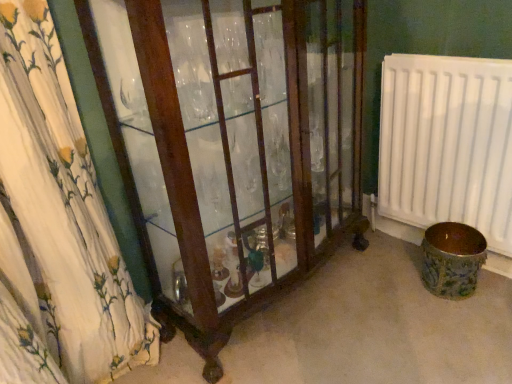
The height and width of the screenshot is (384, 512). Find the location of `brown ceramic vase at lower right`. brown ceramic vase at lower right is located at coordinates (452, 259).

I want to click on white plastic radiator at right, so click(447, 144).

Is brown ceramic vase at lower right inside white plastic radiator at right?

No, brown ceramic vase at lower right is located outside of white plastic radiator at right.

How many degrees apart are the facing directions of white plastic radiator at right and brown ceramic vase at lower right?

The angle between the facing direction of white plastic radiator at right and the facing direction of brown ceramic vase at lower right is 0.431 degrees.

Which of these two, white plastic radiator at right or brown ceramic vase at lower right, is wider?

Wider between the two is brown ceramic vase at lower right.

Does point (433, 214) lie in front of point (251, 20)?

No.

Identify the location of radiator directly beneath the mahogany glass cabinet at left (from a real-world perspective). Image resolution: width=512 pixels, height=384 pixels. (447, 144).

Between white plastic radiator at right and mahogany glass cabinet at left, which one appears on the right side from the viewer's perspective?

From the viewer's perspective, white plastic radiator at right appears more on the right side.

Which of these two, white plastic radiator at right or mahogany glass cabinet at left, is wider?

mahogany glass cabinet at left.

Based on the photo, from the image's perspective, relative to white plastic radiator at right, is mahogany glass cabinet at left above or below?

From the image's perspective, mahogany glass cabinet at left appears below white plastic radiator at right.

Which is in front, point (162, 250) or point (393, 180)?

The point (162, 250) is closer to the camera.

From a real-world perspective, is mahogany glass cabinet at left physically below white plastic radiator at right?

Incorrect, from a real-world perspective, mahogany glass cabinet at left is higher than white plastic radiator at right.

Is mahogany glass cabinet at left oriented away from white plastic radiator at right?

No, mahogany glass cabinet at left's orientation is not away from white plastic radiator at right.

Is brown ceramic vase at lower right next to white plastic radiator at right and touching it?

They are not placed beside each other.

Considering the sizes of brown ceramic vase at lower right and white plastic radiator at right in the image, is brown ceramic vase at lower right wider or thinner than white plastic radiator at right?

Clearly, brown ceramic vase at lower right has more width compared to white plastic radiator at right.

This screenshot has height=384, width=512. Identify the location of toilet bowl lying behind the white plastic radiator at right. (452, 259).

What's the angular difference between mahogany glass cabinet at left and brown ceramic vase at lower right's facing directions?

The angular difference between mahogany glass cabinet at left and brown ceramic vase at lower right is 90.9 degrees.

Which object is wider, mahogany glass cabinet at left or brown ceramic vase at lower right?

mahogany glass cabinet at left is wider.

Identify the location of furniture to the left of brown ceramic vase at lower right. The image size is (512, 384). (241, 155).

Can we say mahogany glass cabinet at left lies outside brown ceramic vase at lower right?

Indeed, mahogany glass cabinet at left is completely outside brown ceramic vase at lower right.

Is mahogany glass cabinet at left a part of brown ceramic vase at lower right?

Definitely not — mahogany glass cabinet at left is not inside brown ceramic vase at lower right.

Considering the sizes of brown ceramic vase at lower right and mahogany glass cabinet at left in the image, is brown ceramic vase at lower right taller or shorter than mahogany glass cabinet at left?

Clearly, brown ceramic vase at lower right is shorter compared to mahogany glass cabinet at left.

Considering the relative positions of brown ceramic vase at lower right and mahogany glass cabinet at left in the image provided, is brown ceramic vase at lower right to the right of mahogany glass cabinet at left from the viewer's perspective?

Yes.

You are a GUI agent. You are given a task and a screenshot of the screen. Output one action in this format:
    pyautogui.click(x=<x>, y=<y>)
    Task: Click on the toilet bowl below the white plastic radiator at right (from the image's perspective)
    This screenshot has width=512, height=384.
    Given the screenshot: What is the action you would take?
    pyautogui.click(x=452, y=259)

Where is `furniture on the left of white plastic radiator at right`? The width and height of the screenshot is (512, 384). furniture on the left of white plastic radiator at right is located at coordinates click(x=241, y=155).

From the image, which object appears to be nearer to mahogany glass cabinet at left, brown ceramic vase at lower right or white plastic radiator at right?

white plastic radiator at right is positioned closer to the anchor mahogany glass cabinet at left.

Which object lies nearer to the anchor point white plastic radiator at right, brown ceramic vase at lower right or mahogany glass cabinet at left?

brown ceramic vase at lower right lies closer to white plastic radiator at right than the other object.

Which object lies nearer to the anchor point white plastic radiator at right, mahogany glass cabinet at left or brown ceramic vase at lower right?

brown ceramic vase at lower right.

Estimate the real-world distances between objects in this image. Which object is further from brown ceramic vase at lower right, mahogany glass cabinet at left or white plastic radiator at right?

Based on the image, mahogany glass cabinet at left appears to be further to brown ceramic vase at lower right.

From the image, which object appears to be nearer to mahogany glass cabinet at left, white plastic radiator at right or brown ceramic vase at lower right?

white plastic radiator at right.

Based on their spatial positions, is white plastic radiator at right or mahogany glass cabinet at left further from brown ceramic vase at lower right?

The object further to brown ceramic vase at lower right is mahogany glass cabinet at left.

Where is `radiator situated between mahogany glass cabinet at left and brown ceramic vase at lower right from left to right`? This screenshot has width=512, height=384. radiator situated between mahogany glass cabinet at left and brown ceramic vase at lower right from left to right is located at coordinates (447, 144).